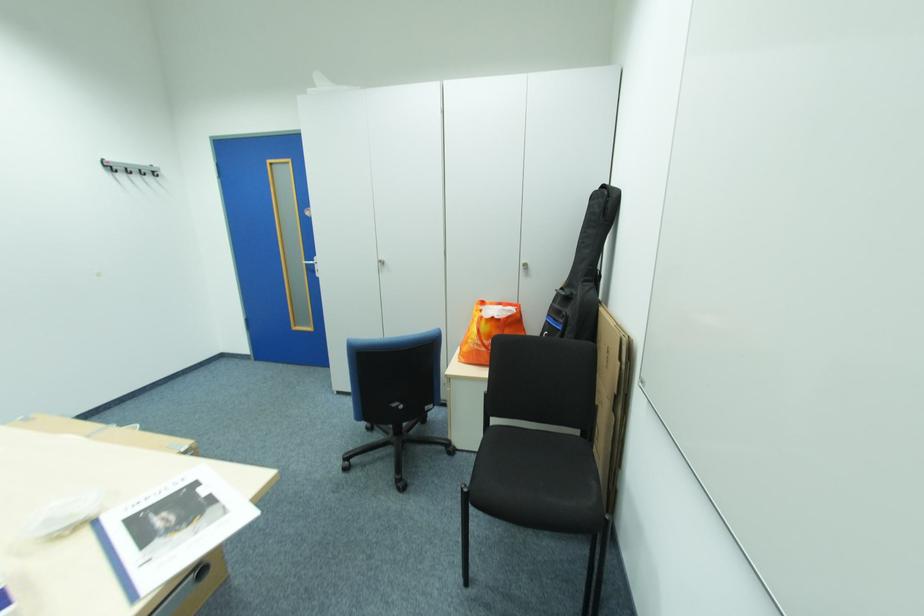
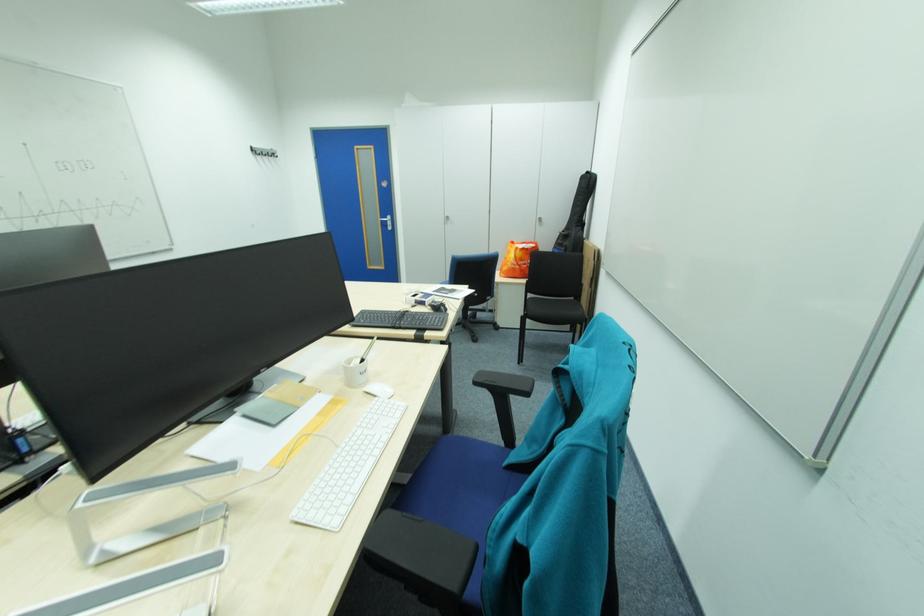
Where in the second image is the point corresponding to (314,265) from the first image?

(390, 221)